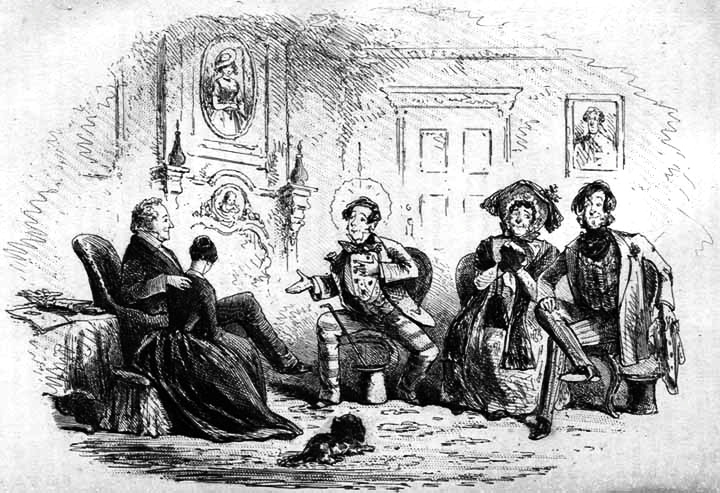
Find the location of a particular element. wall is located at coordinates (107, 158), (318, 96), (479, 72), (643, 173).